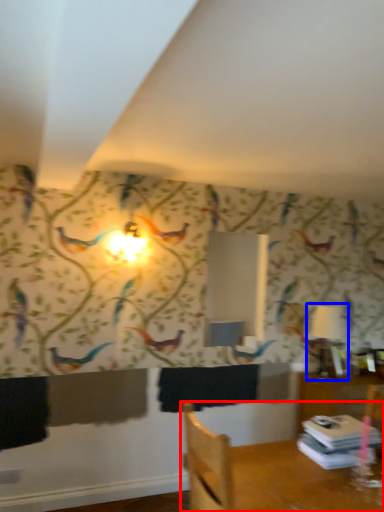
Question: Among these objects, which one is farthest to the camera, furniture (highlighted by a red box) or table lamp (highlighted by a blue box)?

Choices:
 (A) furniture
 (B) table lamp

Answer: (B)